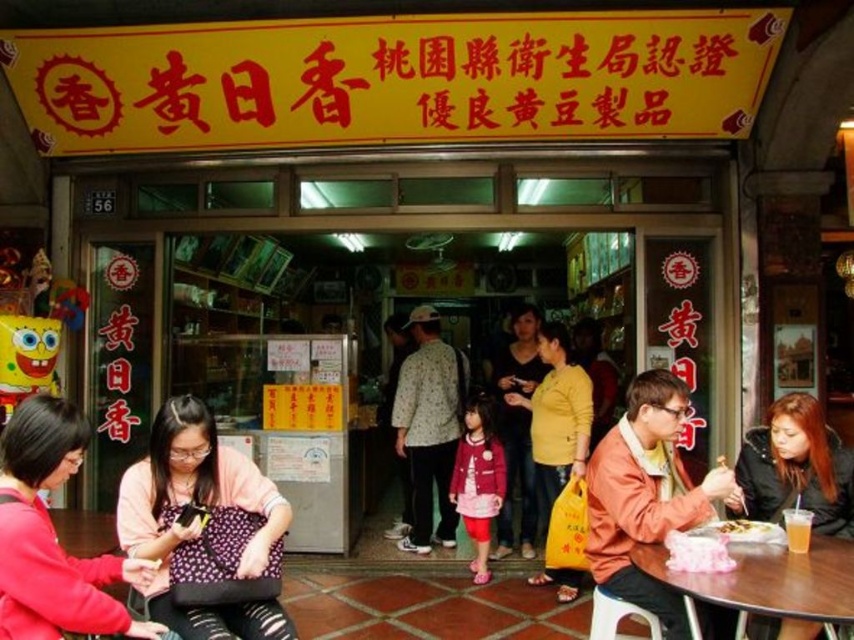
You are standing at the entrance of the eatery and want to sit down at the wooden table at lower right. Which direction should you move to reach it?

Since the wooden table at lower right is located at point [765,580], you should move towards the lower right direction from the entrance to reach it.

You are a customer entering the eatery and want to sit down at the wooden table at lower right. Is the white plastic stool at lower right located behind the table or in front of it?

The wooden table at lower right is in front of the white plastic stool at lower right, so the stool is behind the table.